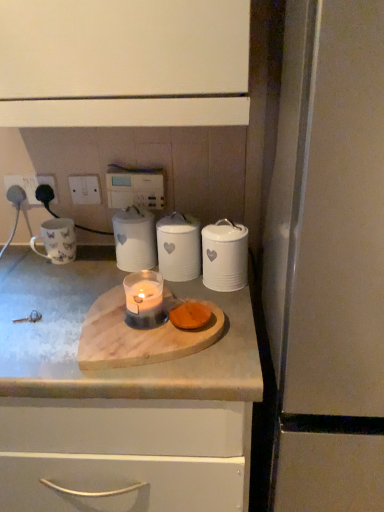
Where is `free spot to the right of matte white mug at left`? The image size is (384, 512). free spot to the right of matte white mug at left is located at coordinates [x=96, y=264].